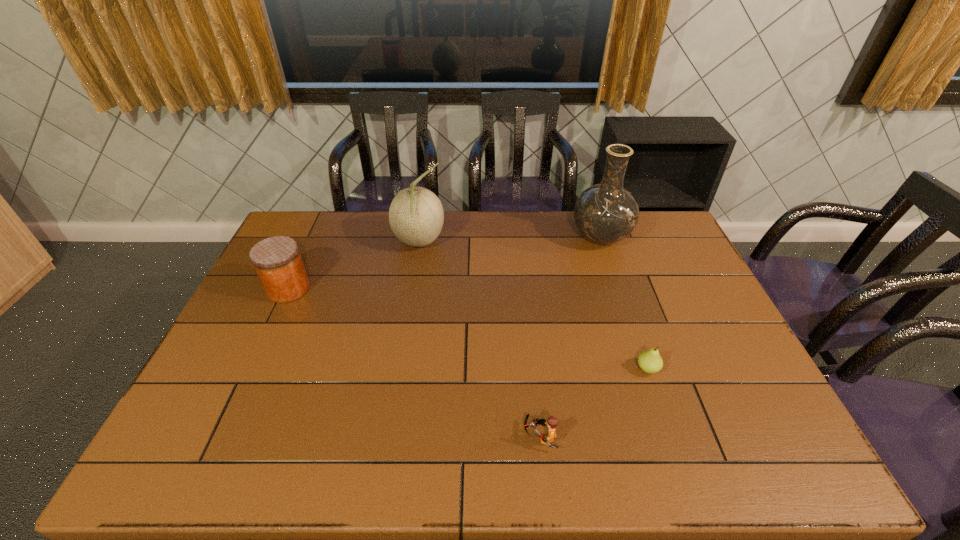
Locate an element on the screen. the tallest object is located at coordinates (606, 213).

Identify the location of the second tallest object. This screenshot has width=960, height=540. (416, 216).

Identify the location of cantaloup. (416, 216).

Where is `the third shortest object`? The height and width of the screenshot is (540, 960). the third shortest object is located at coordinates (277, 260).

This screenshot has width=960, height=540. I want to click on jar, so click(277, 260).

Where is `the fourth farthest object`? This screenshot has width=960, height=540. the fourth farthest object is located at coordinates (650, 361).

The height and width of the screenshot is (540, 960). Identify the location of the third object from right to left. (552, 421).

This screenshot has height=540, width=960. I want to click on Lego, so click(x=552, y=421).

Where is `vacant position located on the left of the vase`? The height and width of the screenshot is (540, 960). vacant position located on the left of the vase is located at coordinates (486, 238).

Locate an element on the screen. This screenshot has height=540, width=960. free spot located 0.380m on the right of the fourth object from right to left is located at coordinates (550, 242).